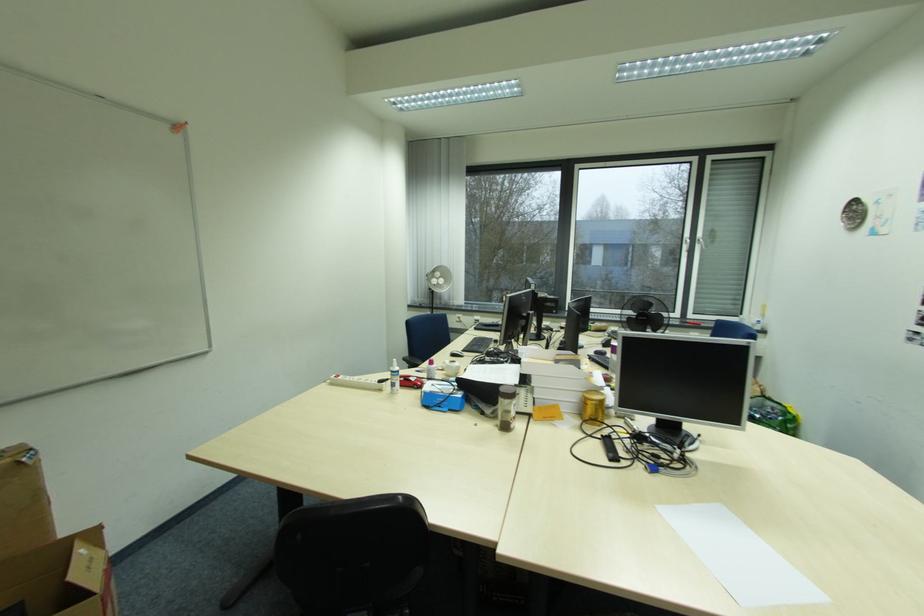
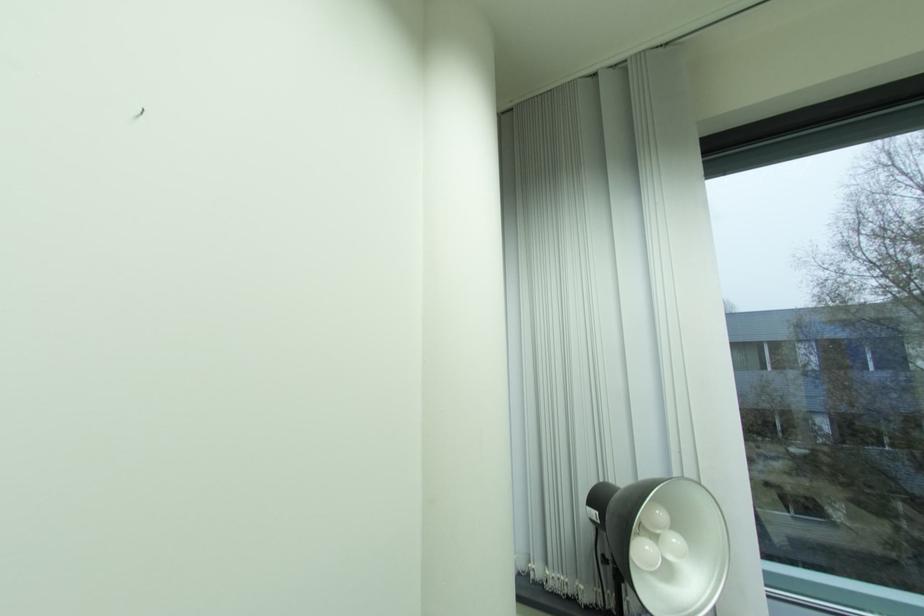
Question: In a continuous first-person perspective shot, in which direction is the camera moving?

Choices:
 (A) Left
 (B) Right
 (C) Forward
 (D) Backward

Answer: (C)